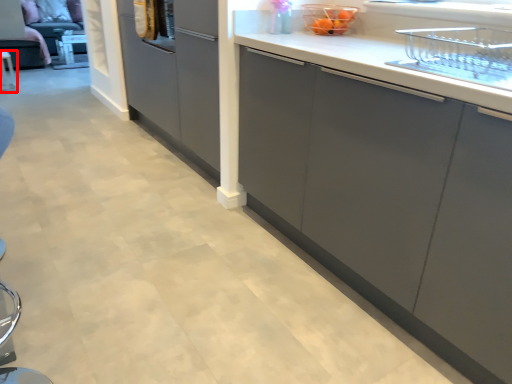
Question: In this image, where is furniture (annotated by the red box) located relative to appliance?

Choices:
 (A) left
 (B) right

Answer: (A)